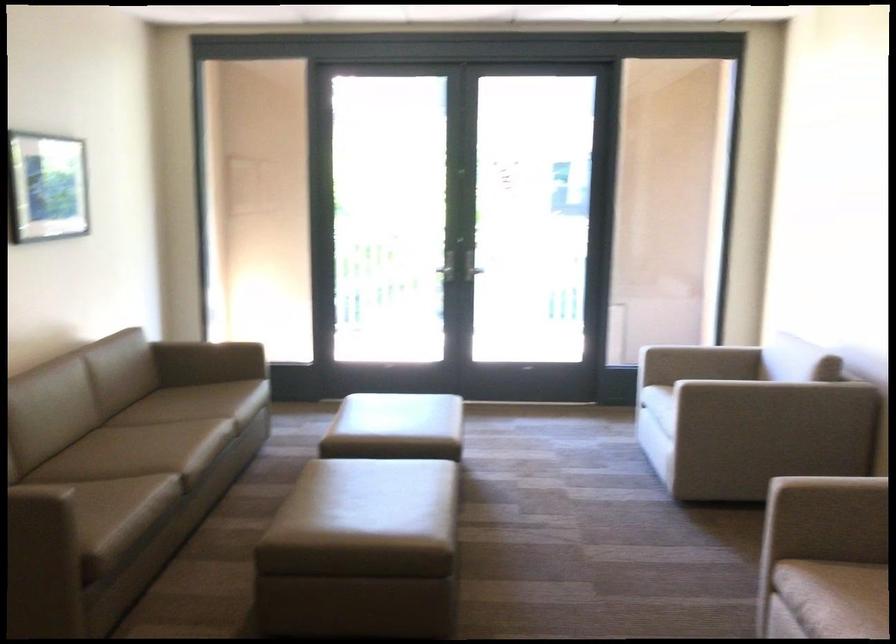
Describe the element at coordinates (207, 362) in the screenshot. I see `the brown sofa armrest` at that location.